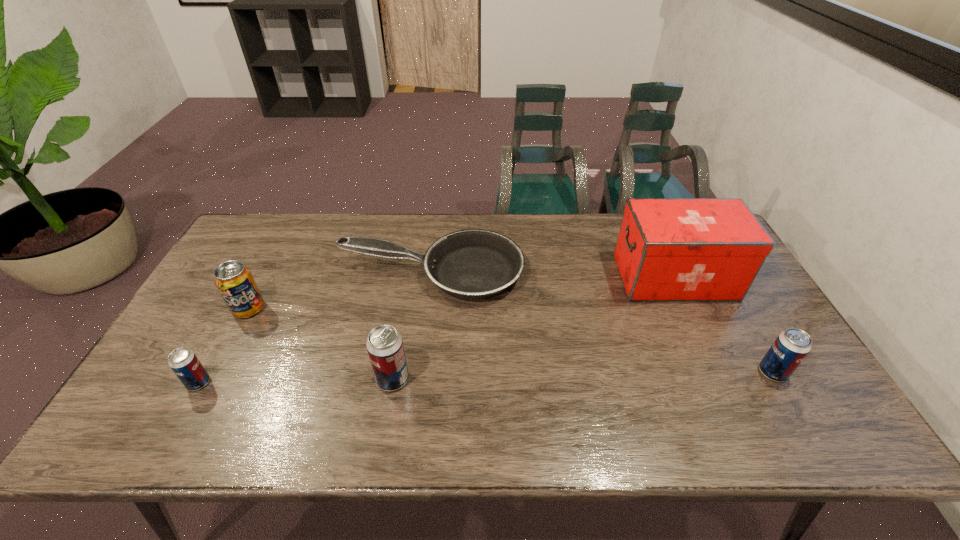
Please mark a free spot for a new beer_can to balance the arrangement. Please provide its 2D coordinates. Your answer should be formatted as a tuple, i.e. [(x, y)], where the tuple contains the x and y coordinates of a point satisfying the conditions above.

[(584, 376)]